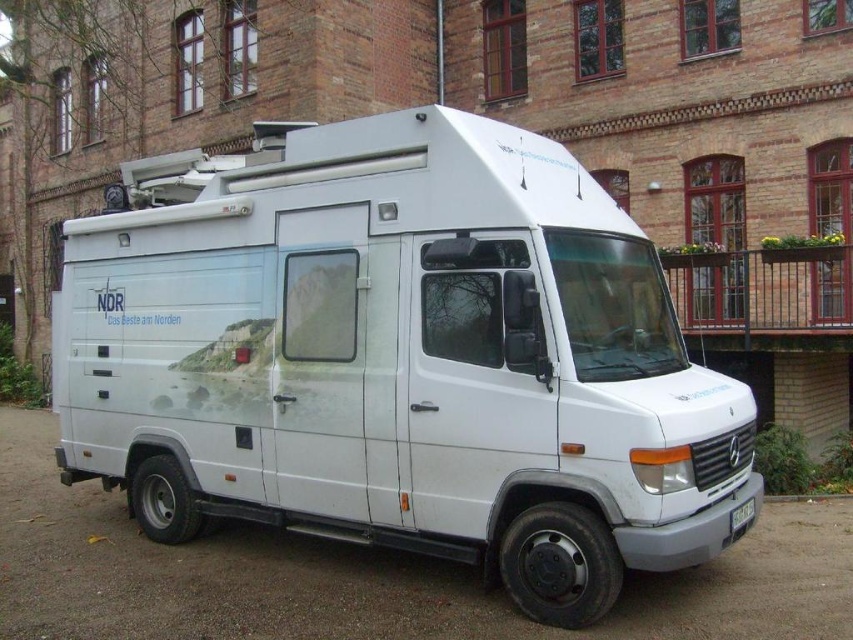
Is white glossy van at center to the right of white plastic license plate at center from the viewer's perspective?

No, white glossy van at center is not to the right of white plastic license plate at center.

The image size is (853, 640). What do you see at coordinates (398, 356) in the screenshot?
I see `white glossy van at center` at bounding box center [398, 356].

Is point (611, 538) behind point (738, 513)?

No.

Identify the location of white glossy van at center. (398, 356).